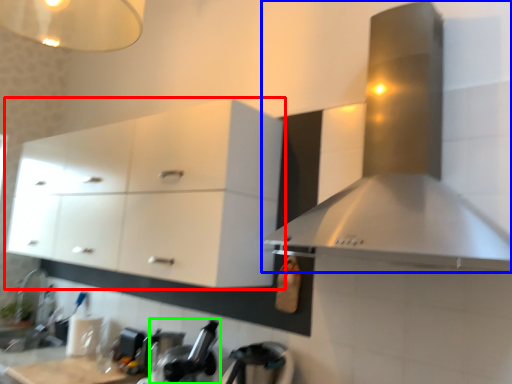
Question: Estimate the real-world distances between objects in this image. Which object is closer to cabinetry (highlighted by a red box), home appliance (highlighted by a blue box) or appliance (highlighted by a green box)?

Choices:
 (A) home appliance
 (B) appliance

Answer: (B)